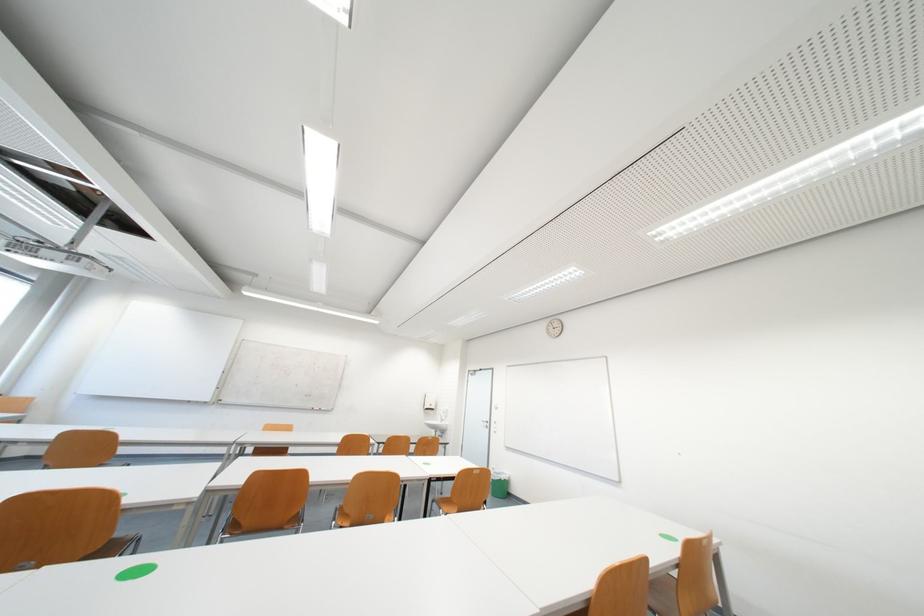
Image resolution: width=924 pixels, height=616 pixels. I want to click on metal door handle, so click(x=484, y=422).